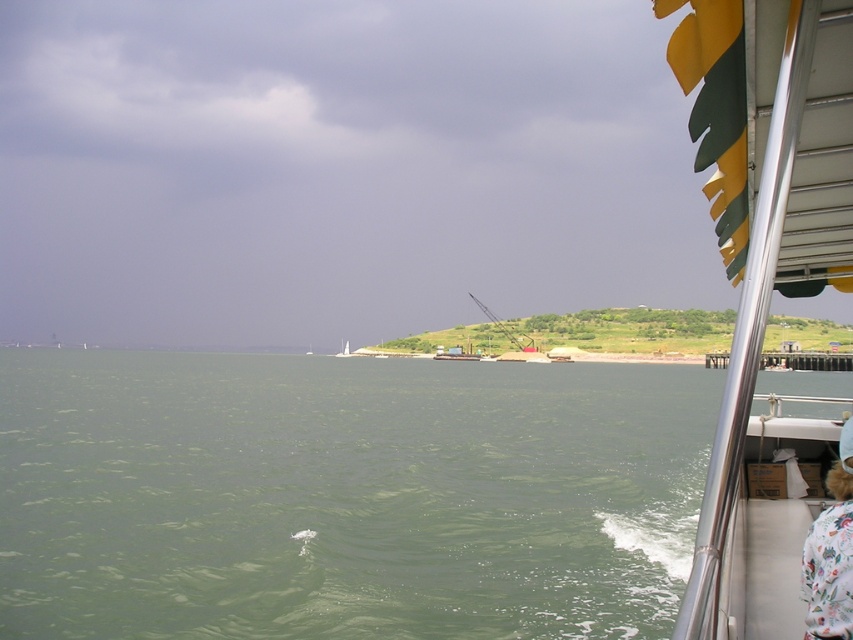
Question: Which of the following is the farthest from the observer?

Choices:
 (A) white plastic boat at center
 (B) fluffy fur coat at lower right
 (C) metallic silver boat at right
 (D) green water at lower left

Answer: (A)

Question: In this image, where is green water at lower left located relative to white plastic boat at center?

Choices:
 (A) below
 (B) above

Answer: (B)

Question: Can you confirm if metallic silver boat at right is positioned below fluffy fur coat at lower right?

Choices:
 (A) no
 (B) yes

Answer: (B)

Question: Is fluffy fur coat at lower right closer to camera compared to white plastic boat at center?

Choices:
 (A) no
 (B) yes

Answer: (B)

Question: Which of the following is the farthest from the observer?

Choices:
 (A) (341, 346)
 (B) (393, 484)

Answer: (A)

Question: Which object appears farthest from the camera in this image?

Choices:
 (A) white plastic boat at center
 (B) metallic silver boat at right
 (C) green water at lower left
 (D) fluffy fur coat at lower right

Answer: (A)